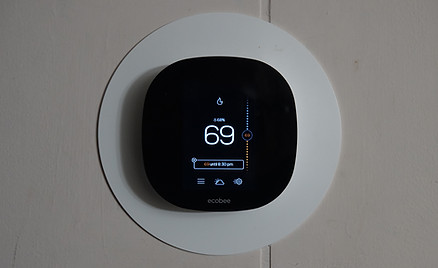
Find the location of `white wall`. white wall is located at coordinates (48, 49).